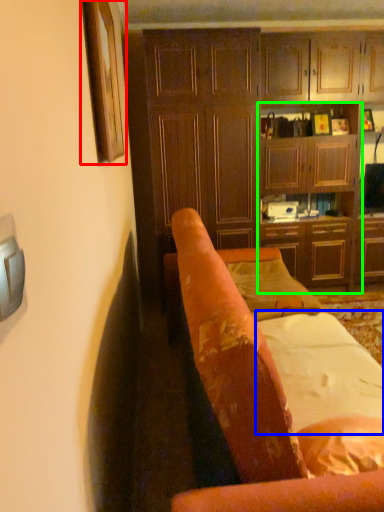
Question: Which object is the closest to the picture frame (highlighted by a red box)? Choose among these: sheet (highlighted by a blue box) or tv cabinet (highlighted by a green box).

Choices:
 (A) sheet
 (B) tv cabinet

Answer: (A)